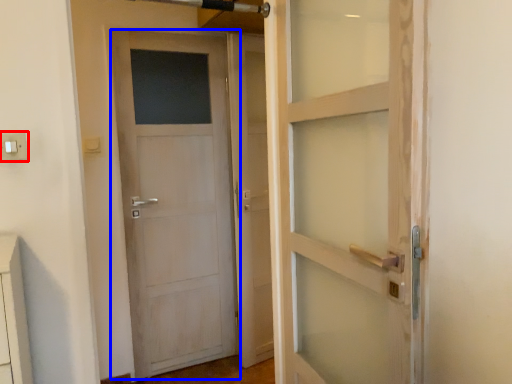
Question: Which of the following is the farthest to the observer, electric outlet (highlighted by a red box) or door (highlighted by a blue box)?

Choices:
 (A) electric outlet
 (B) door

Answer: (B)